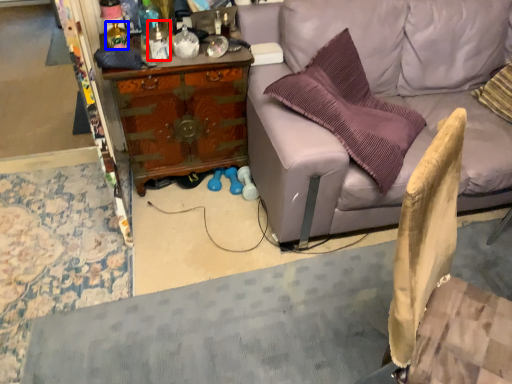
Question: Which of the following is the closest to the observer, bottle (highlighted by a red box) or bottle (highlighted by a blue box)?

Choices:
 (A) bottle
 (B) bottle

Answer: (A)